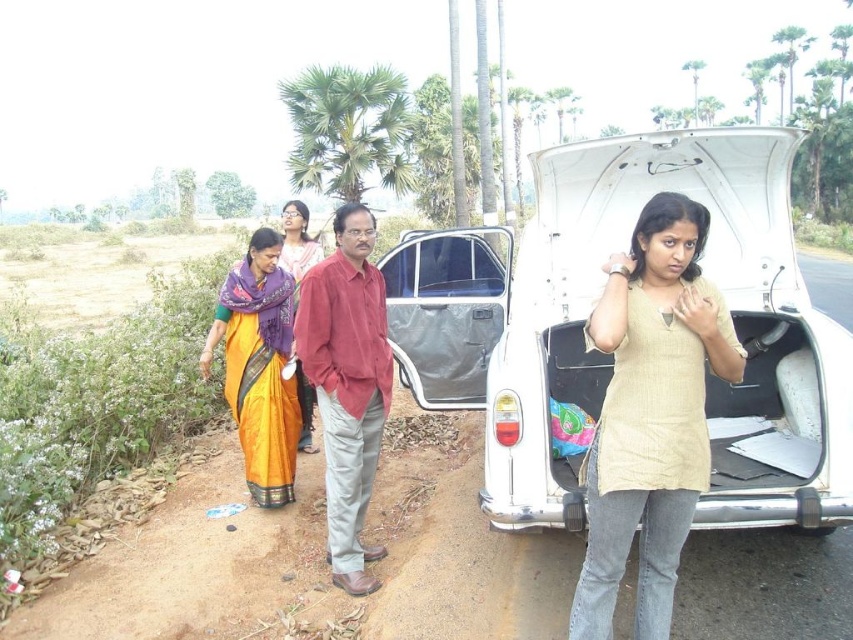
Which is above, beige cotton tunic at center or orange silk saree at left?

Positioned higher is orange silk saree at left.

Between point (645, 323) and point (257, 468), which one is positioned in front?

Positioned in front is point (645, 323).

Locate an element on the screen. beige cotton tunic at center is located at coordinates (650, 413).

Between beige cotton tunic at center and metallic gray minivan at center, which one has more height?

beige cotton tunic at center

Is beige cotton tunic at center wider than metallic gray minivan at center?

No, beige cotton tunic at center is not wider than metallic gray minivan at center.

The height and width of the screenshot is (640, 853). Describe the element at coordinates (650, 413) in the screenshot. I see `beige cotton tunic at center` at that location.

Where is `beige cotton tunic at center`? beige cotton tunic at center is located at coordinates (650, 413).

Is red cotton shirt at center below metallic gray minivan at center?

Indeed, red cotton shirt at center is positioned under metallic gray minivan at center.

Which is below, red cotton shirt at center or metallic gray minivan at center?

Positioned lower is red cotton shirt at center.

Which is behind, point (364, 220) or point (463, 362)?

Positioned behind is point (463, 362).

In order to click on red cotton shirt at center in this screenshot , I will do `click(347, 384)`.